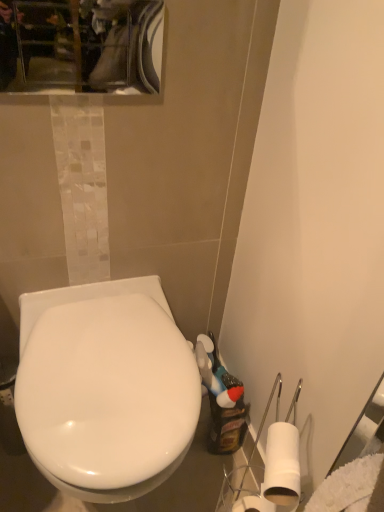
The height and width of the screenshot is (512, 384). Describe the element at coordinates (105, 388) in the screenshot. I see `white glossy toilet at center` at that location.

This screenshot has height=512, width=384. In order to click on white glossy toilet at center in this screenshot , I will do `click(105, 388)`.

The height and width of the screenshot is (512, 384). Describe the element at coordinates (81, 45) in the screenshot. I see `glossy glass mirror at upper center` at that location.

Locate an element on the screen. This screenshot has height=512, width=384. glossy glass mirror at upper center is located at coordinates (81, 45).

What is the approximate width of glossy glass mirror at upper center?

The width of glossy glass mirror at upper center is 1.77 inches.

What are the coordinates of `white glossy toilet at center` in the screenshot? It's located at (105, 388).

Is glossy glass mirror at upper center to the left of white glossy toilet at center from the viewer's perspective?

Yes, glossy glass mirror at upper center is to the left of white glossy toilet at center.

Is the position of glossy glass mirror at upper center more distant than that of white glossy toilet at center?

Yes, it is.

Considering the positions of point (47, 35) and point (136, 314), is point (47, 35) closer or farther from the camera than point (136, 314)?

Point (47, 35) is positioned farther from the camera compared to point (136, 314).

From the image's perspective, does glossy glass mirror at upper center appear higher than white glossy toilet at center?

Yes.

From a real-world perspective, who is located higher, glossy glass mirror at upper center or white glossy toilet at center?

From a 3D spatial view, glossy glass mirror at upper center is above.

Is glossy glass mirror at upper center wider than white glossy toilet at center?

No.

Can you confirm if glossy glass mirror at upper center is taller than white glossy toilet at center?

No.

Can you confirm if glossy glass mirror at upper center is smaller than white glossy toilet at center?

Yes.

Can white glossy toilet at center be found inside glossy glass mirror at upper center?

No, white glossy toilet at center is located outside of glossy glass mirror at upper center.

Is glossy glass mirror at upper center touching white glossy toilet at center?

No, glossy glass mirror at upper center is not beside white glossy toilet at center.

Could you tell me if glossy glass mirror at upper center is facing white glossy toilet at center?

No, glossy glass mirror at upper center is not facing towards white glossy toilet at center.

Looking at this image, can you tell me how much glossy glass mirror at upper center and white glossy toilet at center differ in facing direction?

2 degrees.

How much distance is there between glossy glass mirror at upper center and white glossy toilet at center?

glossy glass mirror at upper center is 74.79 centimeters away from white glossy toilet at center.

Identify the location of toilet located underneath the glossy glass mirror at upper center (from a real-world perspective). Image resolution: width=384 pixels, height=512 pixels. (105, 388).

Is white glossy toilet at center at the right side of glossy glass mirror at upper center?

Yes.

Is the position of white glossy toilet at center more distant than that of glossy glass mirror at upper center?

No, white glossy toilet at center is closer to the viewer.

Which is less distant, (174, 453) or (10, 27)?

Clearly, point (174, 453) is closer to the camera than point (10, 27).

From the image's perspective, which one is positioned lower, white glossy toilet at center or glossy glass mirror at upper center?

white glossy toilet at center appears lower in the image.

From a real-world perspective, is white glossy toilet at center above or below glossy glass mirror at upper center?

white glossy toilet at center is situated lower than glossy glass mirror at upper center in the real world.

Which of these two, white glossy toilet at center or glossy glass mirror at upper center, is wider?

Wider between the two is white glossy toilet at center.

Is white glossy toilet at center taller than glossy glass mirror at upper center?

Yes.

Can you confirm if white glossy toilet at center is bigger than glossy glass mirror at upper center?

Yes.

Is white glossy toilet at center spatially inside glossy glass mirror at upper center, or outside of it?

white glossy toilet at center is located beyond the bounds of glossy glass mirror at upper center.

Are white glossy toilet at center and glossy glass mirror at upper center making contact?

No, white glossy toilet at center is not beside glossy glass mirror at upper center.

Is white glossy toilet at center positioned with its back to glossy glass mirror at upper center?

No, white glossy toilet at center is not facing away from glossy glass mirror at upper center.

Can you tell me how much white glossy toilet at center and glossy glass mirror at upper center differ in facing direction?

There is a 2-degree angle between the facing directions of white glossy toilet at center and glossy glass mirror at upper center.

How distant is white glossy toilet at center from glossy glass mirror at upper center?

white glossy toilet at center and glossy glass mirror at upper center are 29.45 inches apart.

The image size is (384, 512). I want to click on mirror above the white glossy toilet at center (from a real-world perspective), so click(x=81, y=45).

The image size is (384, 512). Find the location of `mirror behind the white glossy toilet at center`. mirror behind the white glossy toilet at center is located at coordinates coord(81,45).

This screenshot has width=384, height=512. I want to click on toilet below the glossy glass mirror at upper center (from the image's perspective), so click(x=105, y=388).